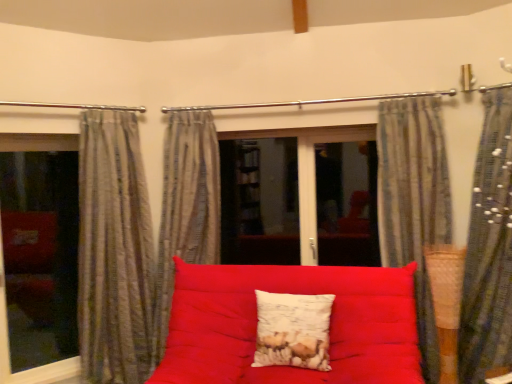
Where is `metallic rod at upper center`? This screenshot has width=512, height=384. metallic rod at upper center is located at coordinates (311, 101).

Describe the element at coordinates (489, 248) in the screenshot. I see `striped fabric curtain at right, which appears as the 1th curtain when viewed from the right` at that location.

Describe the element at coordinates (414, 203) in the screenshot. I see `striped fabric curtain at upper right, placed as the 3th curtain when sorted from left to right` at that location.

The width and height of the screenshot is (512, 384). In order to click on metallic rod at upper center in this screenshot , I will do `click(311, 101)`.

Considering the relative positions of striped fabric curtain at center, the 2th curtain from the left, and white textured pillow at center in the image provided, is striped fabric curtain at center, the 2th curtain from the left, to the left or to the right of white textured pillow at center?

Clearly, striped fabric curtain at center, the 2th curtain from the left, is on the left of white textured pillow at center in the image.

Considering the points (194, 158) and (266, 326), which point is in front, point (194, 158) or point (266, 326)?

The point (266, 326) is in front.

Is striped fabric curtain at center, which is the 3th curtain in right-to-left order, oriented away from white textured pillow at center?

striped fabric curtain at center, which is the 3th curtain in right-to-left order, is not turned away from white textured pillow at center.

Between striped fabric curtain at center, which is the 3th curtain in right-to-left order, and white textured pillow at center, which one has more height?

Standing taller between the two is striped fabric curtain at center, which is the 3th curtain in right-to-left order.

Between point (497, 182) and point (201, 110), which one is positioned in front?

The point (497, 182) is in front.

From the image's perspective, is striped fabric curtain at right, which appears as the 1th curtain when viewed from the right, above or below metallic rod at upper center?

Clearly, from the image's perspective, striped fabric curtain at right, which appears as the 1th curtain when viewed from the right, is below metallic rod at upper center.

Is striped fabric curtain at right, which appears as the 1th curtain when viewed from the right, taller than metallic rod at upper center?

Yes, striped fabric curtain at right, which appears as the 1th curtain when viewed from the right, is taller than metallic rod at upper center.

Looking at this image, which object is positioned more to the left, striped fabric curtain at upper right, the 2th curtain in the right-to-left sequence, or metallic rod at upper center?

metallic rod at upper center is more to the left.

Is point (438, 221) closer or farther from the camera than point (414, 92)?

Clearly, point (438, 221) is closer to the camera than point (414, 92).

Considering the sizes of objects striped fabric curtain at upper right, the 2th curtain in the right-to-left sequence, and metallic rod at upper center in the image provided, who is wider, striped fabric curtain at upper right, the 2th curtain in the right-to-left sequence, or metallic rod at upper center?

striped fabric curtain at upper right, the 2th curtain in the right-to-left sequence, is wider.

Locate an element on the screen. The image size is (512, 384). the 3rd curtain in front when counting from the metallic rod at upper center is located at coordinates (414, 203).

Is metallic rod at upper center bigger or smaller than matte red fabric studio couch at center?

In the image, metallic rod at upper center appears to be smaller than matte red fabric studio couch at center.

Is matte red fabric studio couch at center at the back of metallic rod at upper center?

metallic rod at upper center does not have its back to matte red fabric studio couch at center.

Considering the relative positions of metallic rod at upper center and matte red fabric studio couch at center in the image provided, is metallic rod at upper center to the right of matte red fabric studio couch at center from the viewer's perspective?

Indeed, metallic rod at upper center is positioned on the right side of matte red fabric studio couch at center.

Between metallic rod at upper center and matte red fabric studio couch at center, which one has less height?

metallic rod at upper center.

Which is in front, point (387, 193) or point (229, 272)?

The point (229, 272) is closer.

Does striped fabric curtain at upper right, the 2th curtain in the right-to-left sequence, touch matte red fabric studio couch at center?

No, striped fabric curtain at upper right, the 2th curtain in the right-to-left sequence, is not in contact with matte red fabric studio couch at center.

Is striped fabric curtain at upper right, the 2th curtain in the right-to-left sequence, wider or thinner than matte red fabric studio couch at center?

striped fabric curtain at upper right, the 2th curtain in the right-to-left sequence, is thinner than matte red fabric studio couch at center.

Who is bigger, striped fabric curtain at upper right, the 2th curtain in the right-to-left sequence, or matte red fabric studio couch at center?

Bigger between the two is matte red fabric studio couch at center.

From the image's perspective, is metallic rod at upper center above or below striped fabric curtain at center, the 2th curtain from the left?

From the image's perspective, metallic rod at upper center appears above striped fabric curtain at center, the 2th curtain from the left.

Which is behind, metallic rod at upper center or striped fabric curtain at center, the 2th curtain from the left?

metallic rod at upper center is behind.

Is metallic rod at upper center turned away from striped fabric curtain at center, which is the 3th curtain in right-to-left order?

metallic rod at upper center is not turned away from striped fabric curtain at center, which is the 3th curtain in right-to-left order.

From a real-world perspective, between striped fabric curtain at center, the 2th curtain from the left, and striped fabric curtain at right, the fourth curtain from the left, who is vertically higher?

From a 3D spatial view, striped fabric curtain at center, the 2th curtain from the left, is above.

Does striped fabric curtain at center, which is the 3th curtain in right-to-left order, have a smaller size compared to striped fabric curtain at right, which appears as the 1th curtain when viewed from the right?

Indeed, striped fabric curtain at center, which is the 3th curtain in right-to-left order, has a smaller size compared to striped fabric curtain at right, which appears as the 1th curtain when viewed from the right.

Is striped fabric curtain at center, which is the 3th curtain in right-to-left order, turned away from striped fabric curtain at right, which appears as the 1th curtain when viewed from the right?

No, striped fabric curtain at center, which is the 3th curtain in right-to-left order, is not facing away from striped fabric curtain at right, which appears as the 1th curtain when viewed from the right.

Identify the location of pillow on the right of striped fabric curtain at center, the 2th curtain from the left. (293, 330).

This screenshot has height=384, width=512. Identify the location of clothesline that appears behind the striped fabric curtain at right, which appears as the 1th curtain when viewed from the right. (311, 101).

Based on their spatial positions, is metallic rod at upper center or gray striped curtain at left, which is the 4th curtain from right to left, closer to white textured pillow at center?

gray striped curtain at left, which is the 4th curtain from right to left, is closer to white textured pillow at center.

When comparing their distances from striped fabric curtain at center, the 2th curtain from the left, does white textured pillow at center or transparent glass window at left seem closer?

Among the two, white textured pillow at center is located nearer to striped fabric curtain at center, the 2th curtain from the left.

From the image, which object appears to be nearer to striped fabric curtain at center, the 2th curtain from the left, transparent glass window at left or striped fabric curtain at upper right, the 2th curtain in the right-to-left sequence?

transparent glass window at left lies closer to striped fabric curtain at center, the 2th curtain from the left, than the other object.

Based on their spatial positions, is matte red fabric studio couch at center or metallic rod at upper center further from transparent glass window at left?

metallic rod at upper center is further to transparent glass window at left.

When comparing their distances from white textured pillow at center, does striped fabric curtain at upper right, the 2th curtain in the right-to-left sequence, or gray striped curtain at left, which is the 4th curtain from right to left, seem closer?

Among the two, striped fabric curtain at upper right, the 2th curtain in the right-to-left sequence, is located nearer to white textured pillow at center.

From the image, which object appears to be farther from striped fabric curtain at right, the fourth curtain from the left, striped fabric curtain at upper right, the 2th curtain in the right-to-left sequence, or white textured pillow at center?

Based on the image, white textured pillow at center appears to be further to striped fabric curtain at right, the fourth curtain from the left.

Considering their positions, is metallic rod at upper center positioned closer to striped fabric curtain at center, which is the 3th curtain in right-to-left order, than striped fabric curtain at upper right, the 2th curtain in the right-to-left sequence?

Among the two, metallic rod at upper center is located nearer to striped fabric curtain at center, which is the 3th curtain in right-to-left order.

Looking at the image, which one is located further to striped fabric curtain at right, the fourth curtain from the left, white textured pillow at center or striped fabric curtain at center, the 2th curtain from the left?

Result: Among the two, striped fabric curtain at center, the 2th curtain from the left, is located further to striped fabric curtain at right, the fourth curtain from the left.

At what (x,y) coordinates should I click in order to perform the action: click on clothesline between gray striped curtain at left, acting as the first curtain starting from the left, and striped fabric curtain at upper right, placed as the 3th curtain when sorted from left to right, from left to right. Please return your answer as a coordinate pair (x, y). The height and width of the screenshot is (384, 512). Looking at the image, I should click on (311, 101).

I want to click on pillow located between striped fabric curtain at center, which is the 3th curtain in right-to-left order, and striped fabric curtain at right, which appears as the 1th curtain when viewed from the right, in the left-right direction, so click(x=293, y=330).

Where is `pillow between matte red fabric studio couch at center and striped fabric curtain at center, which is the 3th curtain in right-to-left order, along the z-axis`? pillow between matte red fabric studio couch at center and striped fabric curtain at center, which is the 3th curtain in right-to-left order, along the z-axis is located at coordinates click(x=293, y=330).

Where is `pillow between transparent glass window at left and striped fabric curtain at right, the fourth curtain from the left, in the horizontal direction`? This screenshot has width=512, height=384. pillow between transparent glass window at left and striped fabric curtain at right, the fourth curtain from the left, in the horizontal direction is located at coordinates (293, 330).